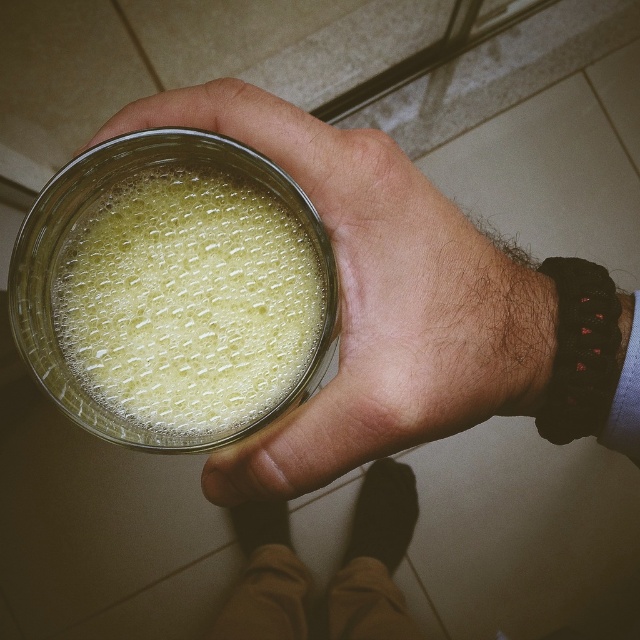
You are a bartender preparing drinks and have two jars in front of you. You need to choose the taller one to serve a drink. Which one should you pick between the clear glass jar at center and the translucent glass jar at center?

The clear glass jar at center is much taller than the translucent glass jar at center, so you should choose the clear glass jar at center to serve the drink.

You are a bartender preparing a drink. You have two jars in front of you, a clear glass jar at center and a translucent glass jar at center. Which jar is placed below the other?

The clear glass jar at center is positioned under the translucent glass jar at center, so the clear glass jar at center is placed below the translucent glass jar at center.

Looking at this image, you are a photographer trying to capture a closeup of the clear glass jar at center. If your camera requires the subject to be at least 10 inches away to focus properly, will you need to adjust your position?

The clear glass jar at center is only 9.28 inches away from the camera, which is less than the required 10 inches for proper focus. Therefore, you need to move the camera further away to ensure the image is in focus.